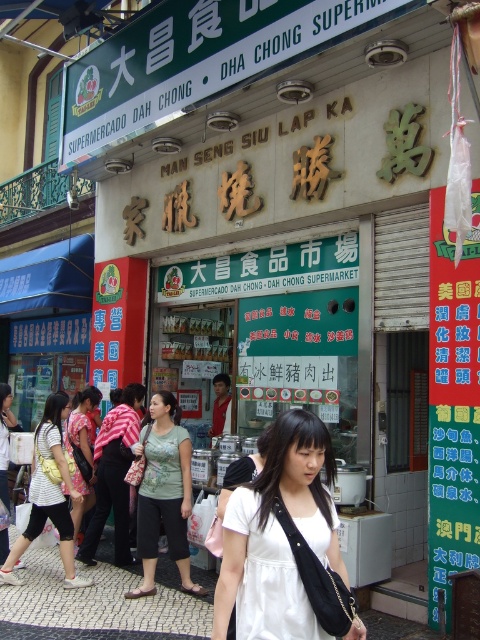
Question: Which object appears farthest from the camera in this image?

Choices:
 (A) white matte shirt at center
 (B) white mosaic pavement at lower center
 (C) light green cotton shirt at lower left
 (D) green cotton shirt at center

Answer: (C)

Question: Can you confirm if green paper at center is positioned below light green cotton shirt at lower left?

Choices:
 (A) yes
 (B) no

Answer: (B)

Question: Observing the image, what is the correct spatial positioning of white matte shirt at center in reference to white mosaic pavement at lower center?

Choices:
 (A) above
 (B) below

Answer: (A)

Question: Is green paper at center smaller than green cotton shirt at center?

Choices:
 (A) yes
 (B) no

Answer: (A)

Question: Which object is the closest to the light green cotton shirt at center?

Choices:
 (A) floral fabric dress at center
 (B) green paper at center
 (C) matte white blouse at center

Answer: (B)

Question: Which of these objects is positioned farthest from the matte white blouse at center?

Choices:
 (A) floral fabric dress at center
 (B) light green cotton shirt at center

Answer: (B)